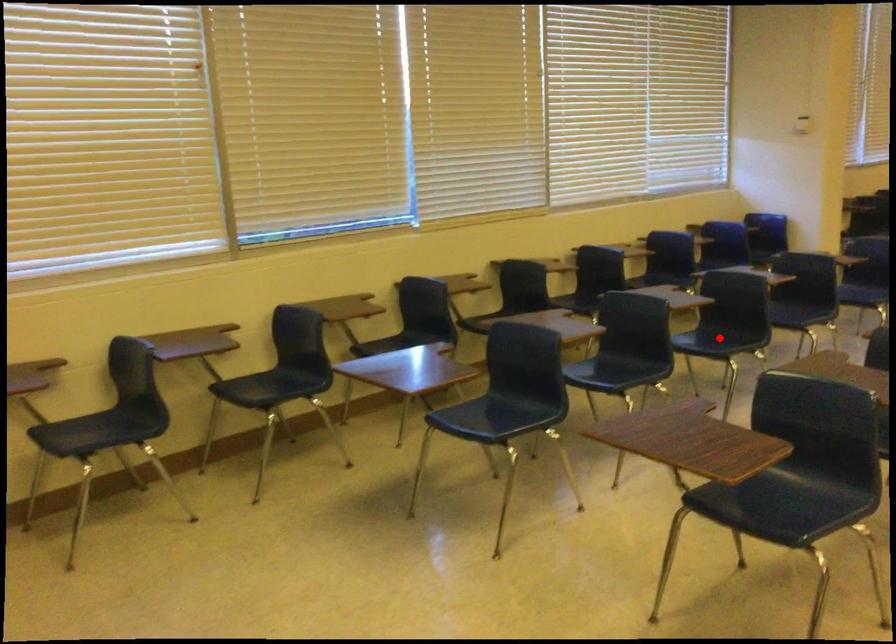
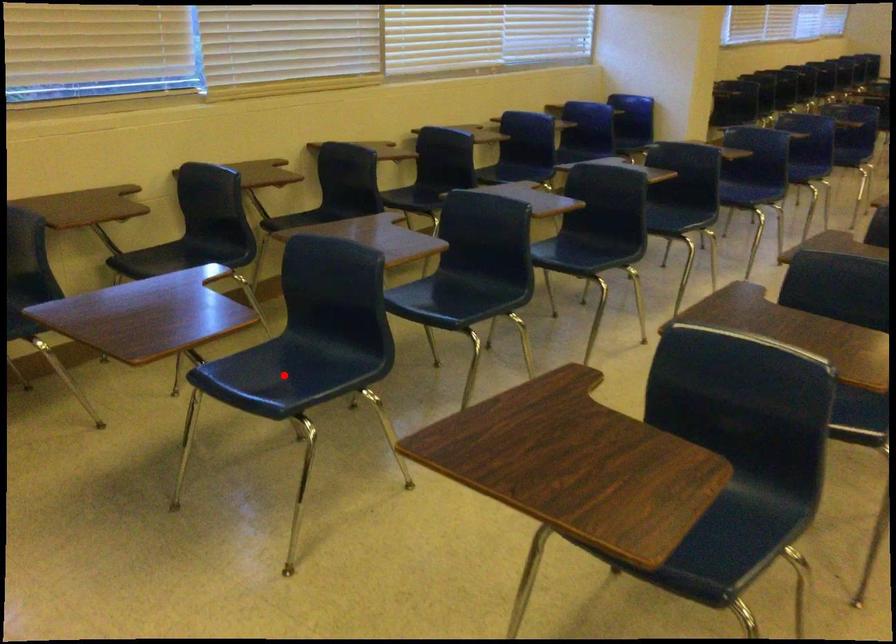
In the scene shown: I am providing you with two images of the same scene from different viewpoints. A red point is marked on the first image and another point is marked on the second image. Are the points marked in image1 and image2 representing the same 3D position?

No